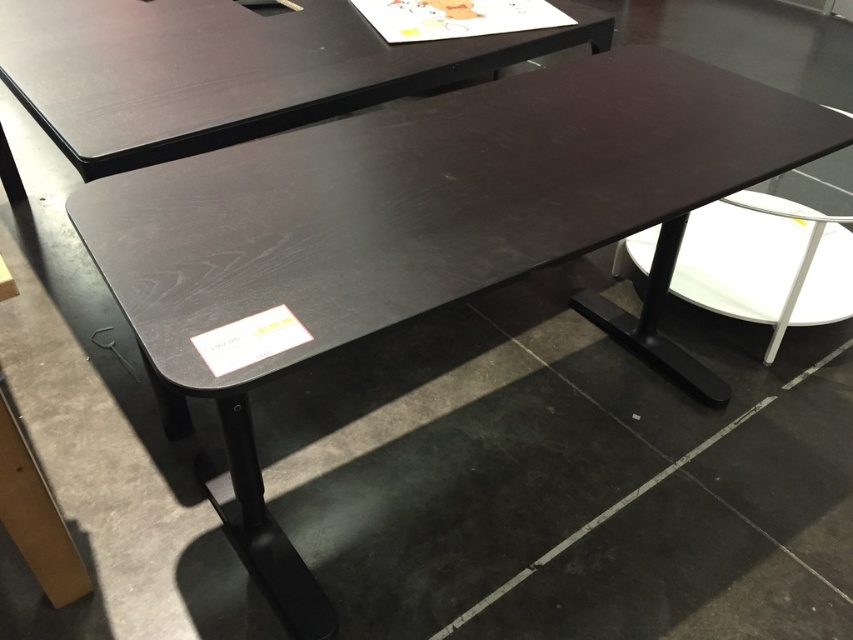
You are a customer in a furniture store and want to place a laptop on the matte black table at upper center and the white glossy stool at center. Which surface can accommodate the laptop better based on their sizes?

The matte black table at upper center is larger in size than the white glossy stool at center, so it can accommodate the laptop better.

You are a customer in a furniture store looking at the matte black table at upper center and the white glossy stool at center. Which object is located to the left of the other?

The matte black table at upper center is positioned on the left side of white glossy stool at center.

You are a customer in a furniture store and want to sit on the white glossy stool at center. Can you reach the matte black table at upper center while sitting?

The matte black table at upper center is taller than the white glossy stool at center, so yes, you can reach it while sitting.